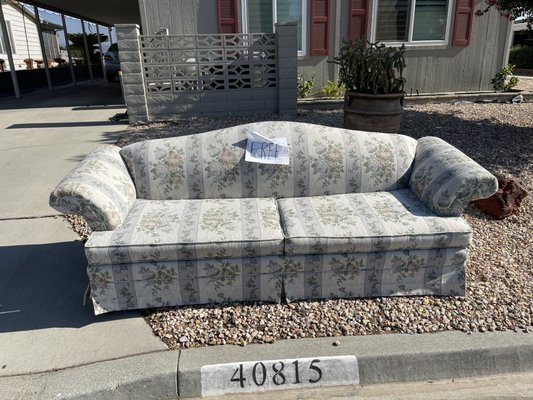
Find the location of a particular element. This screenshot has width=533, height=400. right armrest is located at coordinates (113, 173).